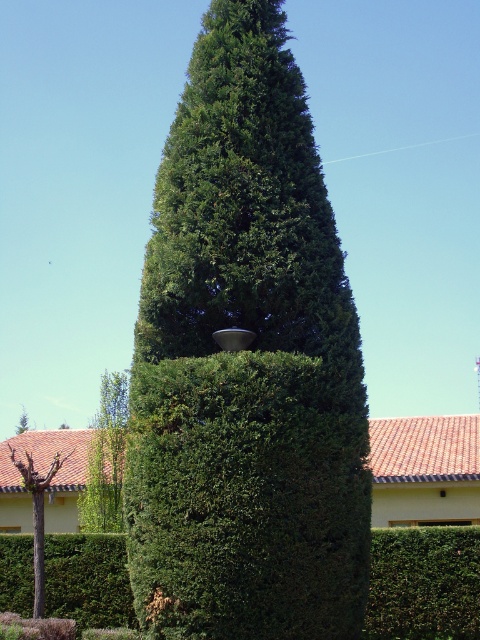
Question: Estimate the real-world distances between objects in this image. Which object is farther from the green leafy tree at lower left?

Choices:
 (A) green leafy shrub at lower right
 (B) brown bark tree at lower left
 (C) green leafy tree at center

Answer: (C)

Question: Does green leafy tree at center appear on the right side of green leafy bush at lower left?

Choices:
 (A) no
 (B) yes

Answer: (B)

Question: Based on their relative distances, which object is farther from the green leafy tree at lower left?

Choices:
 (A) green leafy tree at center
 (B) brown bark tree at lower left

Answer: (A)

Question: Can you confirm if green leafy bush at lower left is positioned to the right of brown bark tree at lower left?

Choices:
 (A) no
 (B) yes

Answer: (B)

Question: Which of the following is the closest to the observer?

Choices:
 (A) (233, 248)
 (B) (156, 445)

Answer: (B)

Question: Does green leafy tree at lower left have a lesser width compared to brown bark tree at lower left?

Choices:
 (A) yes
 (B) no

Answer: (B)